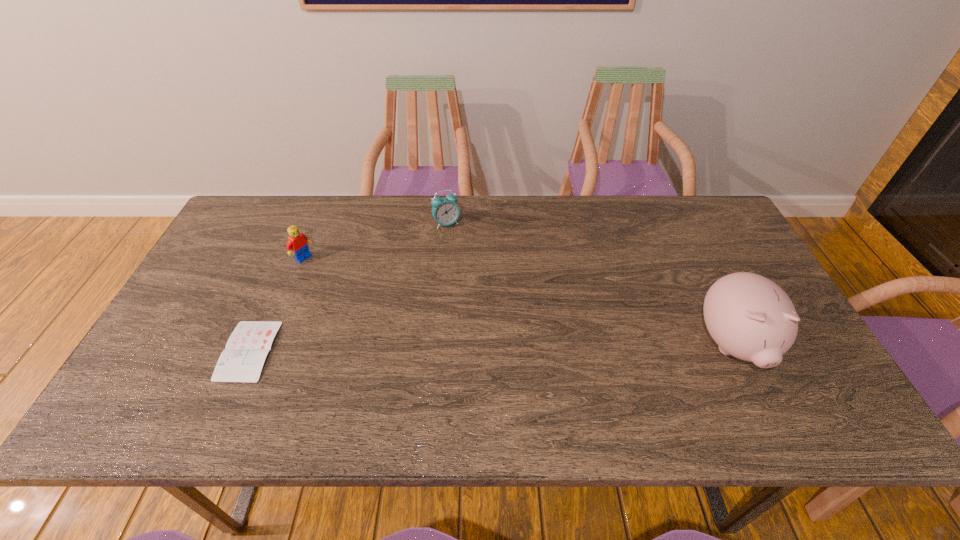
Locate an element on the screen. The height and width of the screenshot is (540, 960). vacant space at the left edge is located at coordinates tap(206, 348).

In the image, there is a desktop. Identify the location of vacant space at the right edge. Image resolution: width=960 pixels, height=540 pixels. (732, 268).

In the image, there is a desktop. In order to click on free region at the far left corner in this screenshot , I will do `click(253, 225)`.

Identify the location of vacant space at the near left corner. (145, 376).

What are the coordinates of `free space at the far right corner of the desktop` in the screenshot? It's located at (724, 222).

At what (x,y) coordinates should I click in order to perform the action: click on empty space that is in between the rightmost object and the alarm clock. Please return your answer as a coordinate pair (x, y). Looking at the image, I should click on (589, 284).

Locate an element on the screen. free area in between the Lego and the tallest object is located at coordinates (518, 301).

This screenshot has height=540, width=960. What are the coordinates of `unoccupied area between the third nearest object and the piggy bank` in the screenshot? It's located at (518, 301).

Locate an element on the screen. The height and width of the screenshot is (540, 960). empty space between the diary and the piggy bank is located at coordinates (491, 348).

Identify the location of vacant space that's between the rightmost object and the second farthest object. The image size is (960, 540). (518, 301).